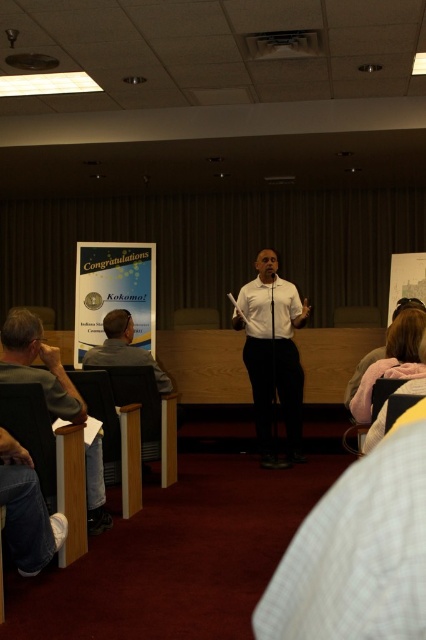
Question: Which object is farther from the camera taking this photo?

Choices:
 (A) matte gray shirt at lower left
 (B) blonde hair at lower right
 (C) gray fabric chair at left
 (D) white smooth shirt at center

Answer: (D)

Question: Can you confirm if white smooth shirt at center is positioned above gray fabric chair at left?

Choices:
 (A) yes
 (B) no

Answer: (A)

Question: Which point is closer to the camera?

Choices:
 (A) white smooth shirt at center
 (B) blonde hair at lower right
 (C) gray fabric chair at left

Answer: (B)

Question: Does white smooth shirt at center appear over matte gray shirt at lower left?

Choices:
 (A) no
 (B) yes

Answer: (B)

Question: Observing the image, what is the correct spatial positioning of white smooth shirt at center in reference to matte gray shirt at lower left?

Choices:
 (A) right
 (B) left

Answer: (A)

Question: Which object is positioned closest to the blonde hair at lower right?

Choices:
 (A) gray fabric chair at left
 (B) matte gray shirt at lower left

Answer: (B)